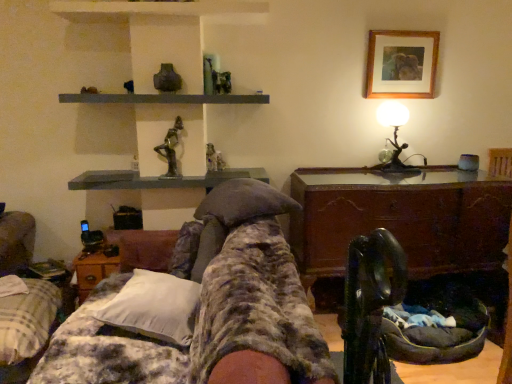
Question: From a real-world perspective, is plaid fabric bedspread at lower left, the second furniture positioned from the right, beneath woodenmaterial/texturetable at lower left, acting as the 1th table starting from the left?

Choices:
 (A) yes
 (B) no

Answer: (A)

Question: Would you say woodenmaterial/texturetable at lower left, the 2th table positioned from the right, is part of plaid fabric bedspread at lower left, acting as the first furniture starting from the left,'s contents?

Choices:
 (A) yes
 (B) no

Answer: (B)

Question: Is plaid fabric bedspread at lower left, the second furniture positioned from the right, not inside woodenmaterial/texturetable at lower left, acting as the 1th table starting from the left?

Choices:
 (A) no
 (B) yes

Answer: (B)

Question: Does plaid fabric bedspread at lower left, acting as the first furniture starting from the left, have a lesser width compared to woodenmaterial/texturetable at lower left, acting as the 1th table starting from the left?

Choices:
 (A) no
 (B) yes

Answer: (A)

Question: From the image's perspective, would you say plaid fabric bedspread at lower left, acting as the first furniture starting from the left, is positioned over woodenmaterial/texturetable at lower left, acting as the 1th table starting from the left?

Choices:
 (A) yes
 (B) no

Answer: (B)

Question: Is plaid fabric bedspread at lower left, acting as the first furniture starting from the left, at the right side of woodenmaterial/texturetable at lower left, the 2th table positioned from the right?

Choices:
 (A) yes
 (B) no

Answer: (B)

Question: Is wooden chest at center, placed as the 1th table when sorted from right to left, shorter than woodenmaterial/texturetable at lower left, acting as the 1th table starting from the left?

Choices:
 (A) yes
 (B) no

Answer: (B)

Question: Does wooden chest at center, the 2th table when ordered from left to right, appear on the right side of woodenmaterial/texturetable at lower left, the 2th table positioned from the right?

Choices:
 (A) yes
 (B) no

Answer: (A)

Question: Is wooden chest at center, the 2th table when ordered from left to right, not close to woodenmaterial/texturetable at lower left, acting as the 1th table starting from the left?

Choices:
 (A) no
 (B) yes

Answer: (B)

Question: Does wooden chest at center, the 2th table when ordered from left to right, lie in front of woodenmaterial/texturetable at lower left, the 2th table positioned from the right?

Choices:
 (A) yes
 (B) no

Answer: (A)

Question: Does wooden chest at center, placed as the 1th table when sorted from right to left, have a greater height compared to woodenmaterial/texturetable at lower left, acting as the 1th table starting from the left?

Choices:
 (A) yes
 (B) no

Answer: (A)

Question: Would you say wooden chest at center, the 2th table when ordered from left to right, is outside woodenmaterial/texturetable at lower left, acting as the 1th table starting from the left?

Choices:
 (A) yes
 (B) no

Answer: (A)

Question: Is matte gray figurine at center taller than plaid fabric bedspread at lower left, acting as the first furniture starting from the left?

Choices:
 (A) no
 (B) yes

Answer: (A)